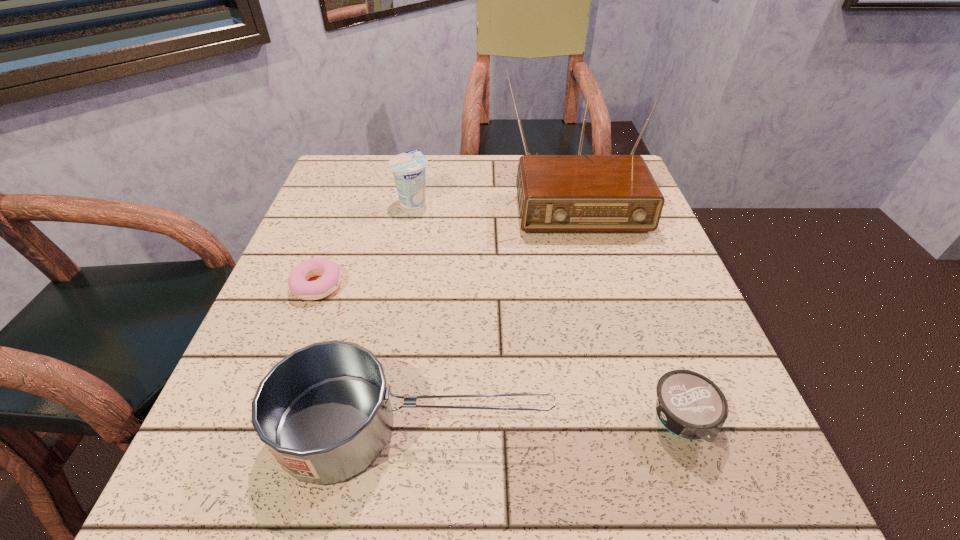
This screenshot has width=960, height=540. I want to click on yogurt present at the right edge, so click(x=689, y=405).

Where is `object located at the near left corner`? This screenshot has width=960, height=540. object located at the near left corner is located at coordinates (324, 412).

Identify the location of object at the far right corner. The image size is (960, 540). (556, 193).

Find the location of a particular element. This screenshot has height=540, width=960. object located at the near right corner is located at coordinates (689, 405).

The image size is (960, 540). In the image, there is a desktop. What are the coordinates of `free region at the near edge` in the screenshot? It's located at (599, 477).

Locate an element on the screen. The height and width of the screenshot is (540, 960). free location at the left edge is located at coordinates (343, 243).

I want to click on vacant space at the right edge of the desktop, so click(x=649, y=301).

Where is `blank region between the pastry and the shorter yogurt`? The width and height of the screenshot is (960, 540). blank region between the pastry and the shorter yogurt is located at coordinates (499, 354).

Identify the location of unoccupied area between the shortest object and the radio_receiver. (444, 238).

Where is `free point between the third farthest object and the left yogurt`? The height and width of the screenshot is (540, 960). free point between the third farthest object and the left yogurt is located at coordinates (366, 243).